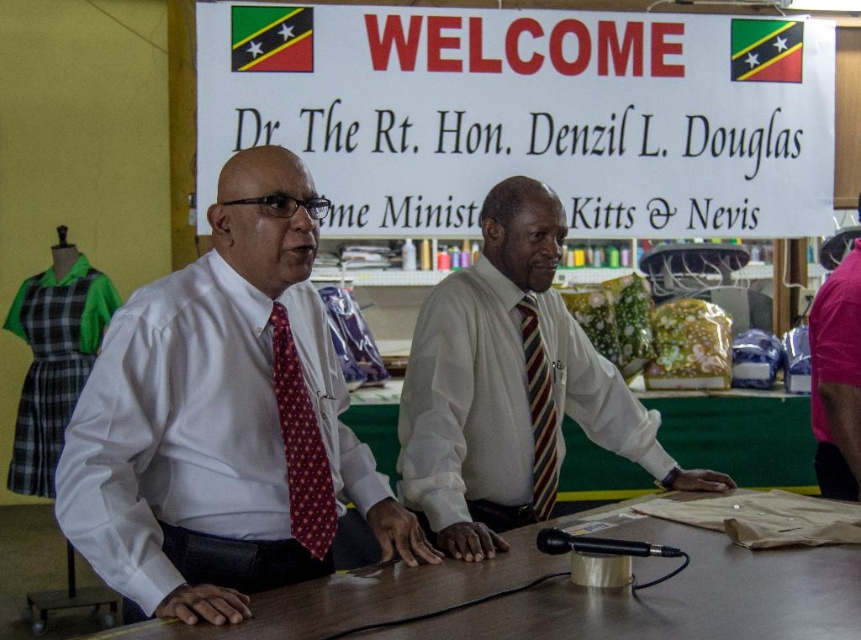
Question: Can you confirm if wooden table at center is wider than dark brown leather hand at center?

Choices:
 (A) yes
 (B) no

Answer: (A)

Question: Does striped tie at center have a smaller size compared to dark brown leather hand at center?

Choices:
 (A) yes
 (B) no

Answer: (B)

Question: Which of these objects is positioned farthest from the polka dot silk tie at center?

Choices:
 (A) matte white shirt at left
 (B) red fabric flag at upper center
 (C) green fabric flag at upper center
 (D) brown leather hand at lower left

Answer: (C)

Question: Based on their relative distances, which object is nearer to the dark brown leather hand at table center?

Choices:
 (A) dark skin hand at table center
 (B) polka dot silk tie at center
 (C) green fabric flag at upper center
 (D) striped tie at center

Answer: (D)

Question: Can you confirm if white paper at upper center is positioned above wooden table at center?

Choices:
 (A) yes
 (B) no

Answer: (A)

Question: Which object is farther from the camera taking this photo?

Choices:
 (A) brown leather hand at lower left
 (B) striped tie at center
 (C) white paper at upper center

Answer: (C)